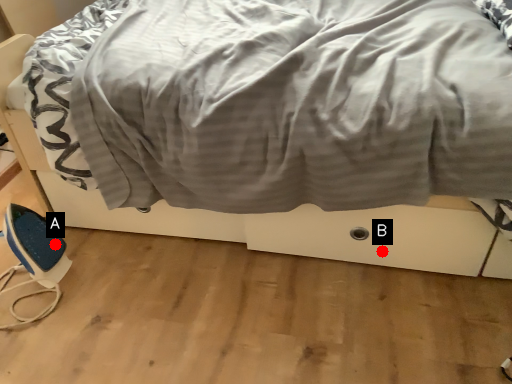
Question: Two points are circled on the image, labeled by A and B beside each circle. Among these points, which one is nearest to the camera?

Choices:
 (A) A is closer
 (B) B is closer

Answer: (B)